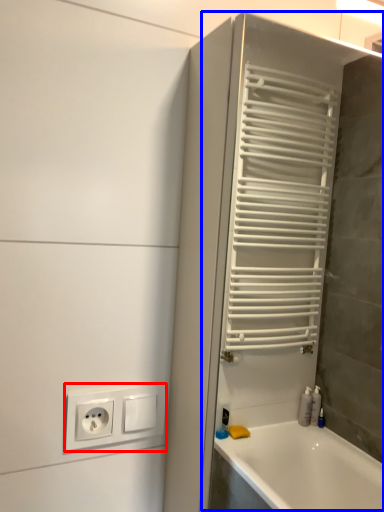
Question: Which object is further to the camera taking this photo, power plugs and sockets (highlighted by a red box) or screen door (highlighted by a blue box)?

Choices:
 (A) power plugs and sockets
 (B) screen door

Answer: (A)